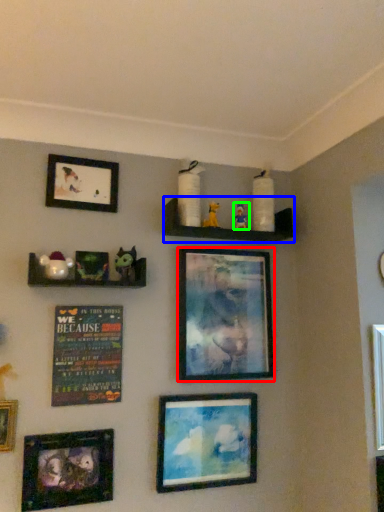
Question: Considering the real-world distances, which object is closest to picture frame (highlighted by a red box)? shelf (highlighted by a blue box) or toy (highlighted by a green box).

Choices:
 (A) shelf
 (B) toy

Answer: (A)